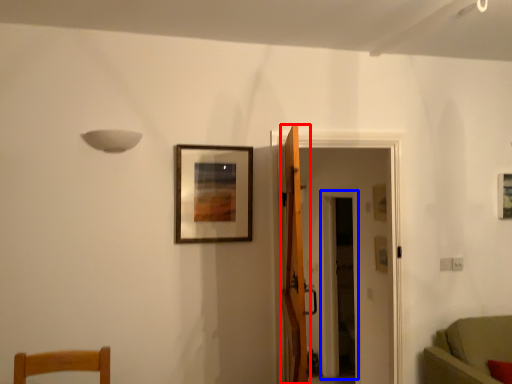
Question: Which object is further to the camera taking this photo, door (highlighted by a red box) or glass door (highlighted by a blue box)?

Choices:
 (A) door
 (B) glass door

Answer: (B)